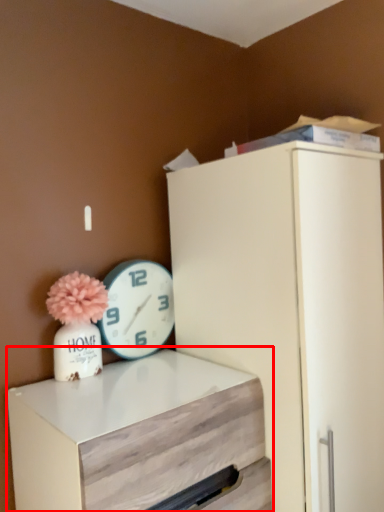
Question: From the image's perspective, considering the relative positions of chest of drawers (annotated by the red box) and wall clock in the image provided, where is chest of drawers (annotated by the red box) located with respect to the staircase?

Choices:
 (A) above
 (B) below

Answer: (B)